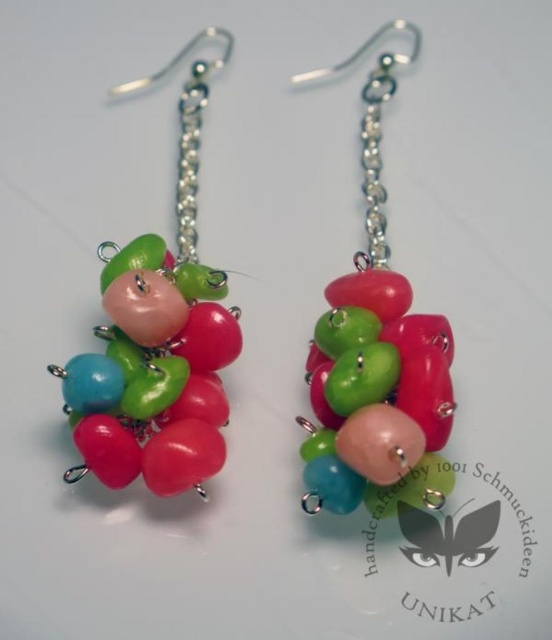
Measure the distance between matte plastic beads at left and matte plastic beads at center.

matte plastic beads at left is 8.38 inches away from matte plastic beads at center.

Is matte plastic beads at left positioned behind matte plastic beads at center?

Yes, it is.

Who is more forward, (x=147, y=342) or (x=401, y=328)?

Point (x=401, y=328) is in front.

I want to click on matte plastic beads at left, so click(158, 337).